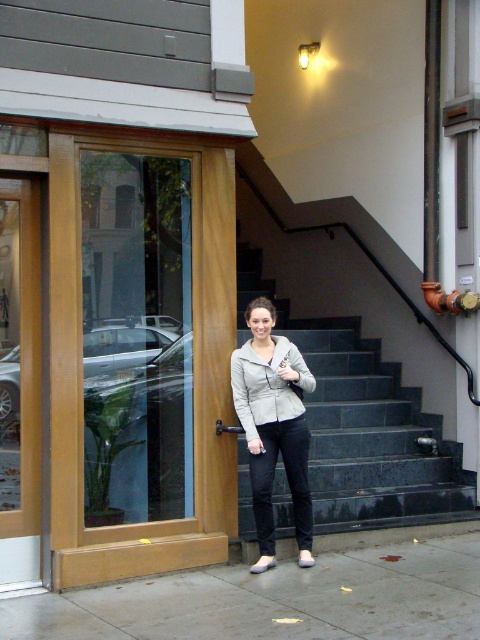
Question: Which of the following is the closest to the observer?

Choices:
 (A) [x=92, y=209]
 (B) [x=346, y=436]
 (C) [x=273, y=417]
 (D) [x=348, y=625]

Answer: (D)

Question: Does clear glass door at left appear over dark gray stone stairs at center?

Choices:
 (A) no
 (B) yes

Answer: (B)

Question: Which object is farther from the camera taking this photo?

Choices:
 (A) gray concrete pavement at lower center
 (B) gray matte jacket at center

Answer: (B)

Question: In this image, where is dark gray stone stairs at center located relative to gray matte jacket at center?

Choices:
 (A) left
 (B) right

Answer: (B)

Question: Which point is closer to the camera?

Choices:
 (A) gray concrete pavement at lower center
 (B) dark gray stone stairs at center
 (C) gray matte jacket at center
 (D) clear glass door at left

Answer: (A)

Question: Does clear glass door at left appear on the right side of dark gray stone stairs at center?

Choices:
 (A) no
 (B) yes

Answer: (A)